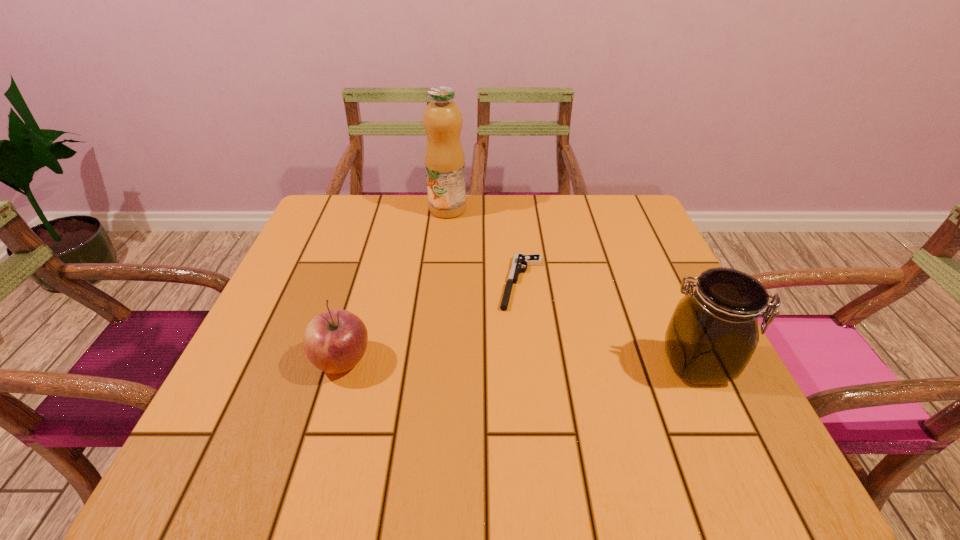
Locate an element on the screen. free space on the desktop that is between the leftmost object and the rightmost object and is positioned on the front label of the farthest object is located at coordinates (477, 362).

This screenshot has width=960, height=540. Identify the location of vacant spot on the desktop that is between the leftmost object and the jar and is positioned on the front-facing side of the third nearest object. click(505, 362).